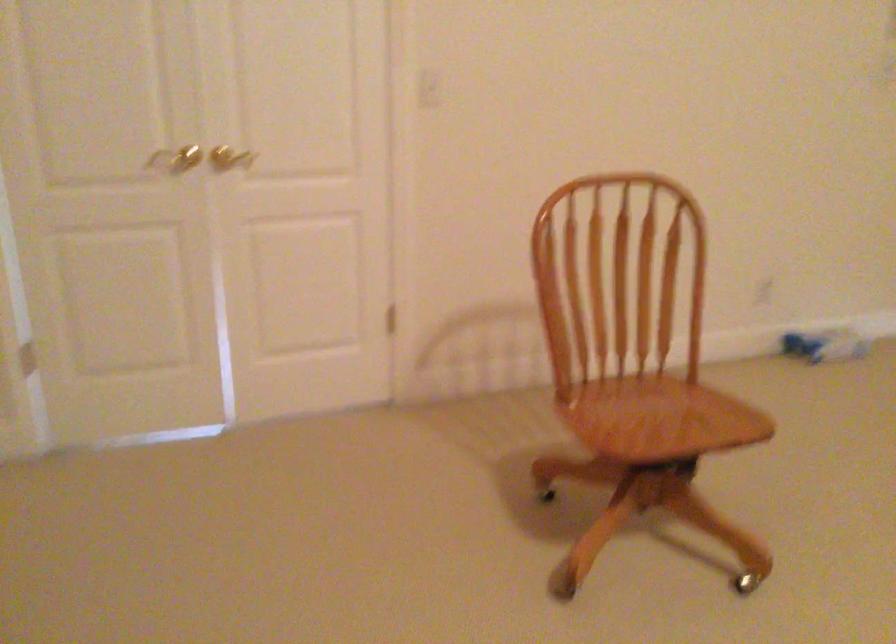
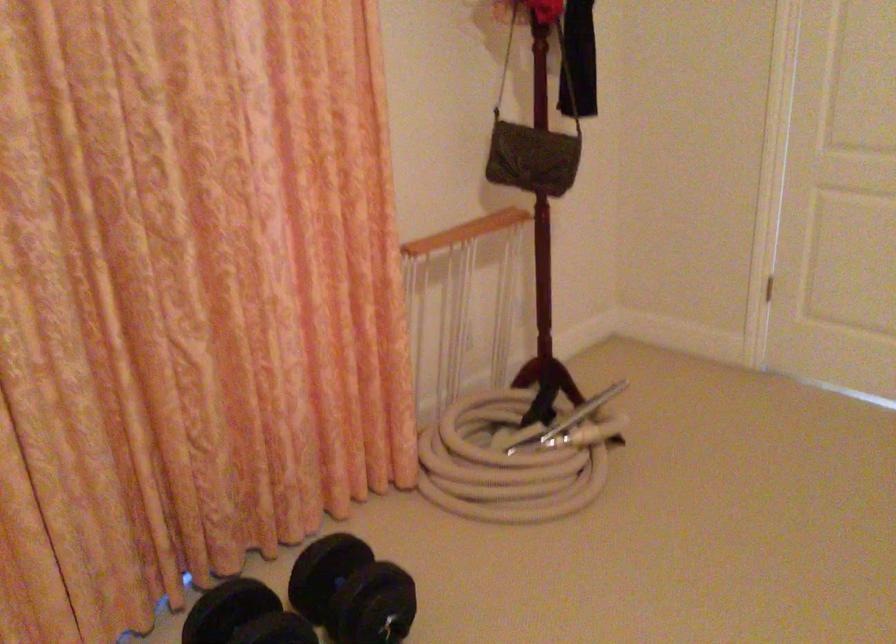
Locate, in the second image, the point that corresponds to the point at 78,360 in the first image.

(762, 283)